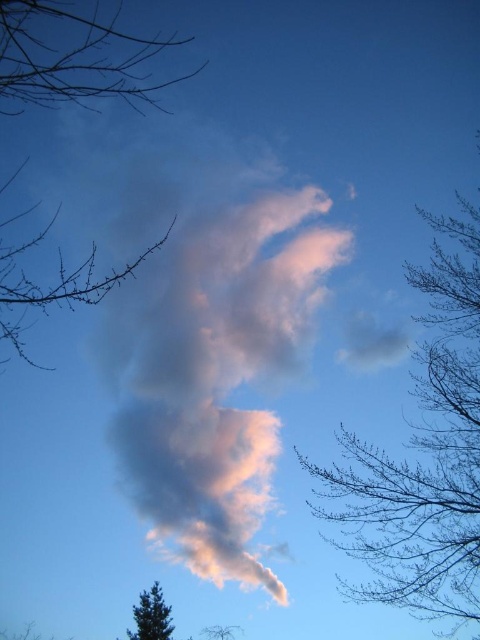
You are an artist sketching the scene and want to ensure the proportions are accurate. Which of the two brown branches, the brown leafless branches at upper center or the brown textured branches at upper left, should you draw taller in your sketch?

The brown leafless branches at upper center should be drawn taller than the brown textured branches at upper left in your sketch.

You are an artist sketching the scene and want to ensure the branches are drawn to scale. Which of the two brown branches, the brown leafless branches at upper center or the brown textured branches at upper left, should be drawn larger?

The brown leafless branches at upper center should be drawn larger because it is bigger than the brown textured branches at upper left according to the description.

You are an artist trying to paint this scene. You want to ensure the brown textured branches at upper left and the green matte tree at lower left are positioned correctly in terms of depth. Which object should you paint first to create the illusion of depth?

You should paint the brown textured branches at upper left first because it is closer to the viewer than the green matte tree at lower left, so painting it over the other object will create the correct depth perception.